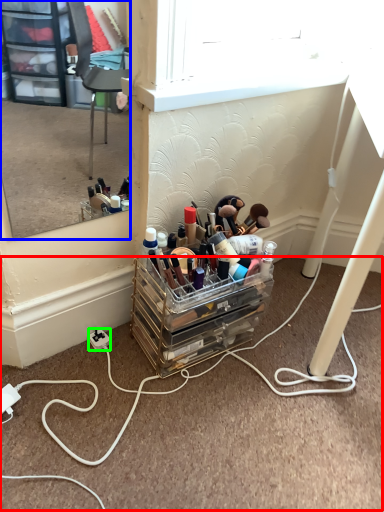
Question: Estimate the real-world distances between objects in this image. Which object is closer to cable (highlighted by a red box), mirror (highlighted by a blue box) or power outlet (highlighted by a green box)?

Choices:
 (A) mirror
 (B) power outlet

Answer: (B)